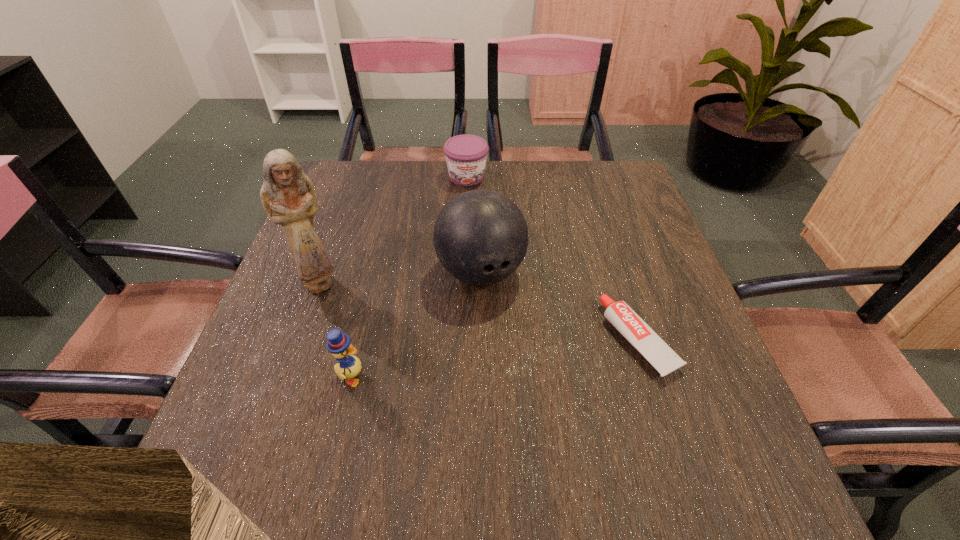
What are the coordinates of `object that is at the far edge` in the screenshot? It's located at (466, 155).

The width and height of the screenshot is (960, 540). I want to click on object positioned at the left edge, so click(287, 195).

In order to click on object positioned at the right edge in this screenshot , I will do `click(619, 314)`.

Where is `vacant space at the far edge of the desktop`? Image resolution: width=960 pixels, height=540 pixels. vacant space at the far edge of the desktop is located at coordinates (542, 183).

At what (x,y) coordinates should I click in order to perform the action: click on vacant point at the near edge. Please return your answer as a coordinate pair (x, y). Image resolution: width=960 pixels, height=540 pixels. Looking at the image, I should click on (410, 406).

In the image, there is a desktop. At what (x,y) coordinates should I click in order to perform the action: click on free region at the left edge. Please return your answer as a coordinate pair (x, y). The width and height of the screenshot is (960, 540). Looking at the image, I should click on (276, 368).

In the image, there is a desktop. Identify the location of vacant space at the right edge. The width and height of the screenshot is (960, 540). (620, 209).

The width and height of the screenshot is (960, 540). In the image, there is a desktop. Find the location of `vacant space at the far left corner`. vacant space at the far left corner is located at coordinates (328, 188).

Locate an element on the screen. vacant area at the near left corner is located at coordinates (241, 414).

What are the coordinates of `vacant space at the far right corner` in the screenshot? It's located at (617, 164).